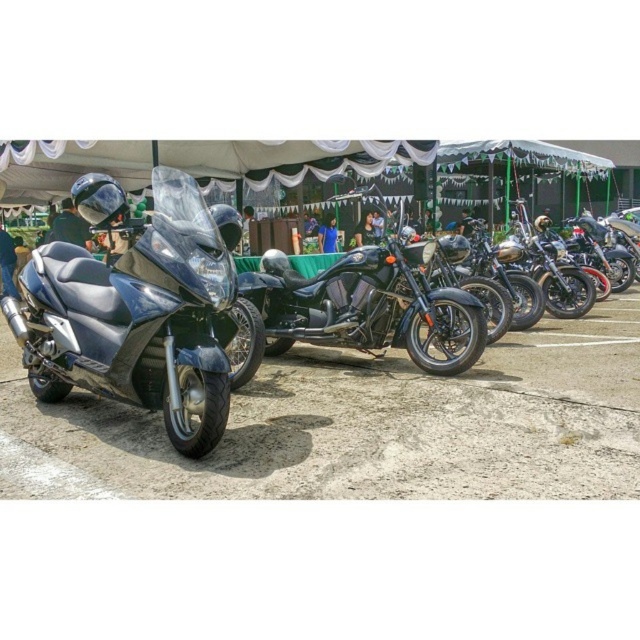
Does matte black scooter at left appear under shiny chrome motorcycle at center?

Indeed, matte black scooter at left is positioned under shiny chrome motorcycle at center.

Is matte black scooter at left bigger than shiny chrome motorcycle at center?

Yes.

This screenshot has width=640, height=640. Find the location of `matte black scooter at left`. matte black scooter at left is located at coordinates (140, 316).

Can you confirm if glossy black motorcycle at center is positioned to the left of shiny chrome motorcycle at center?

Correct, you'll find glossy black motorcycle at center to the left of shiny chrome motorcycle at center.

What do you see at coordinates (369, 307) in the screenshot? The width and height of the screenshot is (640, 640). I see `glossy black motorcycle at center` at bounding box center [369, 307].

Does point (428, 330) lie in front of point (584, 294)?

Yes, it is.

Identify the location of glossy black motorcycle at center. (369, 307).

Can you confirm if matte black scooter at left is positioned above glossy black motorcycle at center?

No.

Is matte black scooter at left to the right of glossy black motorcycle at center from the viewer's perspective?

Incorrect, matte black scooter at left is not on the right side of glossy black motorcycle at center.

Locate an element on the screen. Image resolution: width=640 pixels, height=640 pixels. matte black scooter at left is located at coordinates (140, 316).

Where is `matte black scooter at left`? The image size is (640, 640). matte black scooter at left is located at coordinates click(140, 316).